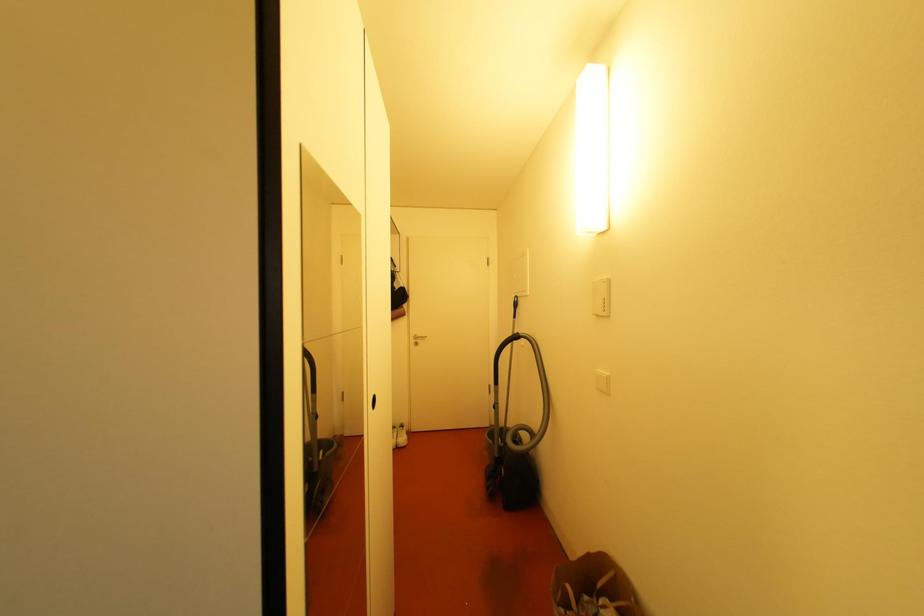
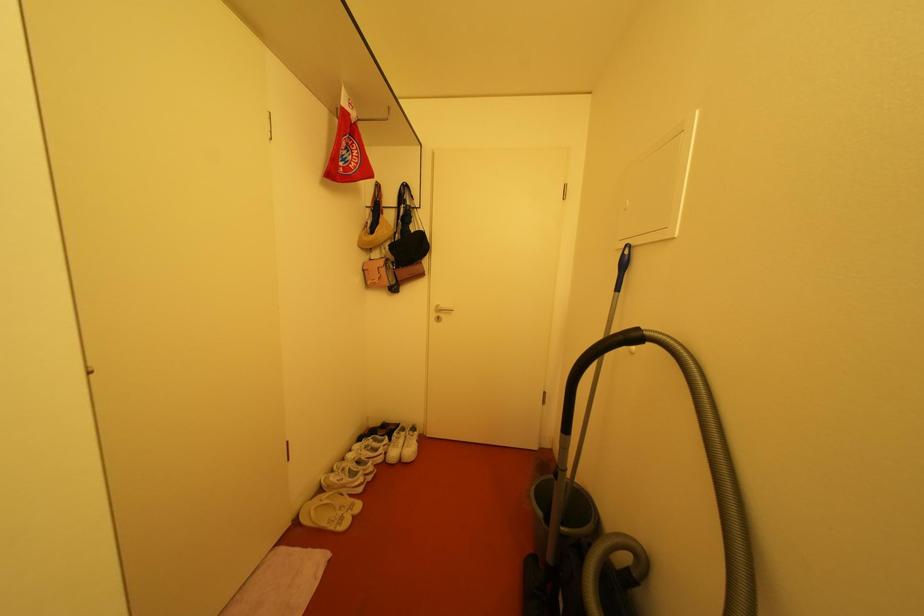
Question: The camera is either moving clockwise (left) or counter-clockwise (right) around the object. The first image is from the beginning of the video and the second image is from the end. Is the camera moving left or right when shooting the video?

Choices:
 (A) Left
 (B) Right

Answer: (B)